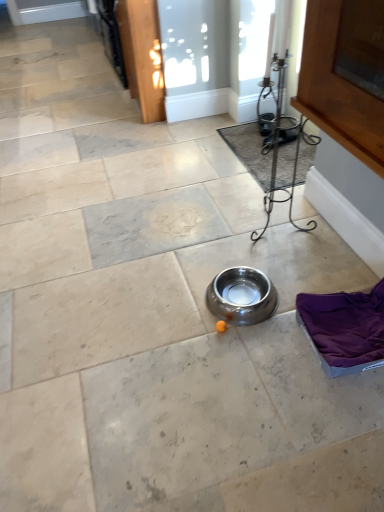
The width and height of the screenshot is (384, 512). In order to click on vacant region to the left of carpeted mat at center in this screenshot , I will do `click(193, 170)`.